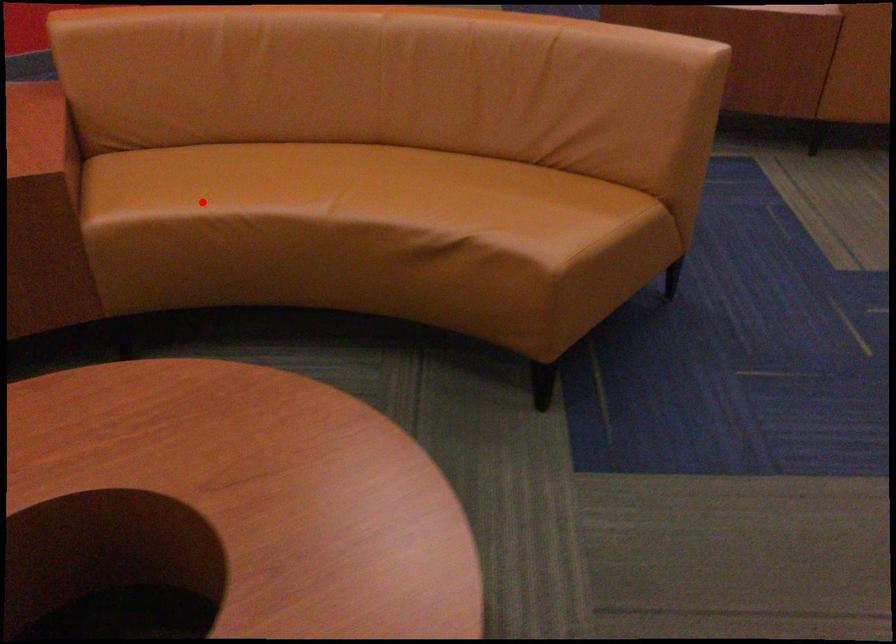
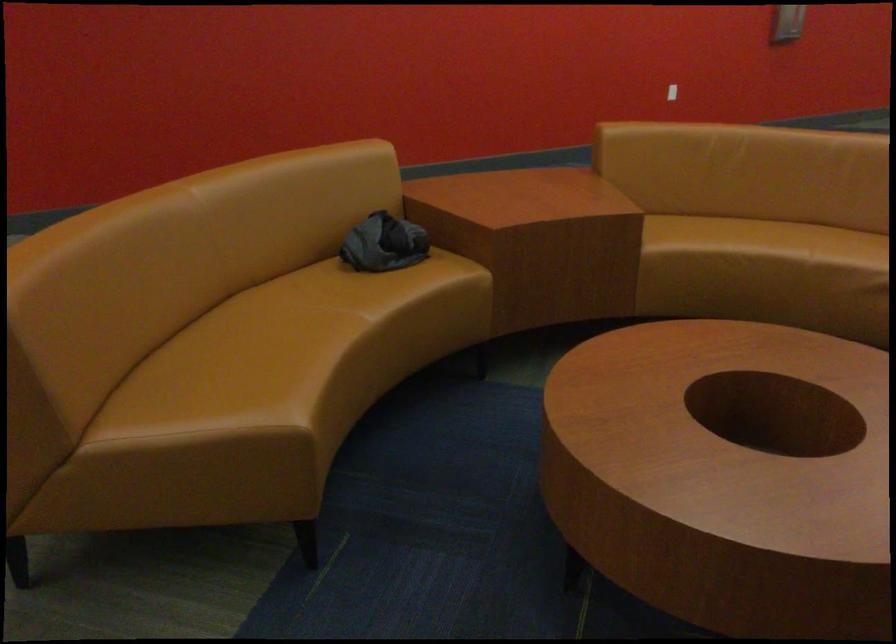
Question: I am providing you with two images of the same scene from different viewpoints. Given a red point in image1, look at the same physical point in image2. Is it:

Choices:
 (A) Closer to the viewpoint
 (B) Farther from the viewpoint

Answer: (B)